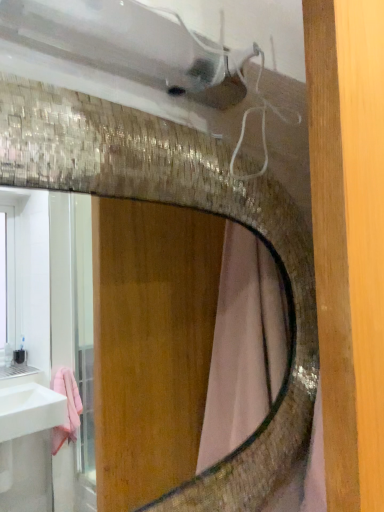
The image size is (384, 512). In order to click on gold mosaic mirror at upper center in this screenshot , I will do `click(146, 351)`.

Image resolution: width=384 pixels, height=512 pixels. What do you see at coordinates (146, 351) in the screenshot?
I see `gold mosaic mirror at upper center` at bounding box center [146, 351].

I want to click on gold mosaic mirror at upper center, so click(146, 351).